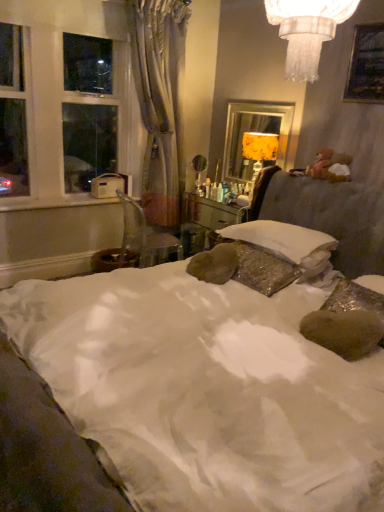
Question: Is white satin bed at center shorter than gold textured lampshade at upper right?

Choices:
 (A) yes
 (B) no

Answer: (B)

Question: Is the depth of white satin bed at center greater than that of gold textured lampshade at upper right?

Choices:
 (A) no
 (B) yes

Answer: (A)

Question: Would you say white satin bed at center is a long distance from gold textured lampshade at upper right?

Choices:
 (A) yes
 (B) no

Answer: (A)

Question: Is gold textured lampshade at upper right completely or partially inside white satin bed at center?

Choices:
 (A) yes
 (B) no

Answer: (B)

Question: Is white satin bed at center wider than gold textured lampshade at upper right?

Choices:
 (A) no
 (B) yes

Answer: (B)

Question: Considering the positions of gold textured lampshade at upper right and white plastic window sill at left in the image, is gold textured lampshade at upper right taller or shorter than white plastic window sill at left?

Choices:
 (A) tall
 (B) short

Answer: (A)

Question: From a real-world perspective, is gold textured lampshade at upper right physically located above or below white plastic window sill at left?

Choices:
 (A) above
 (B) below

Answer: (A)

Question: Is point (266, 116) closer or farther from the camera than point (1, 210)?

Choices:
 (A) farther
 (B) closer

Answer: (A)

Question: Based on their positions, is gold textured lampshade at upper right located to the left or right of white plastic window sill at left?

Choices:
 (A) right
 (B) left

Answer: (A)

Question: Is white plastic window sill at left inside the boundaries of silvery drapery at left, or outside?

Choices:
 (A) outside
 (B) inside

Answer: (A)

Question: Does point (21, 198) appear closer or farther from the camera than point (157, 101)?

Choices:
 (A) farther
 (B) closer

Answer: (B)

Question: Is white plastic window sill at left taller or shorter than silvery drapery at left?

Choices:
 (A) tall
 (B) short

Answer: (B)

Question: In the image, is white plastic window sill at left on the left side or the right side of silvery drapery at left?

Choices:
 (A) left
 (B) right

Answer: (A)

Question: Is white plastic window sill at left taller or shorter than gold textured lampshade at upper right?

Choices:
 (A) short
 (B) tall

Answer: (A)

Question: Is white plastic window sill at left in front of or behind gold textured lampshade at upper right in the image?

Choices:
 (A) front
 (B) behind

Answer: (A)